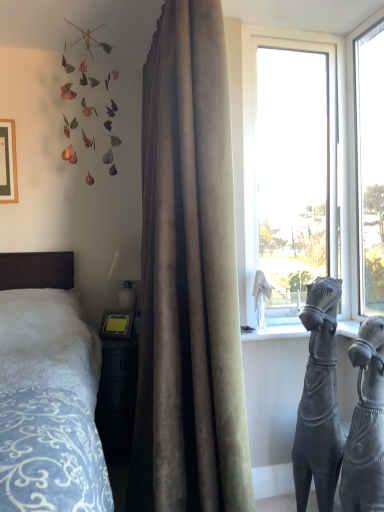
Identify the location of free point to the right of transparent glass sculpture at window, the 2th sculpture positioned from the front. The height and width of the screenshot is (512, 384). (284, 332).